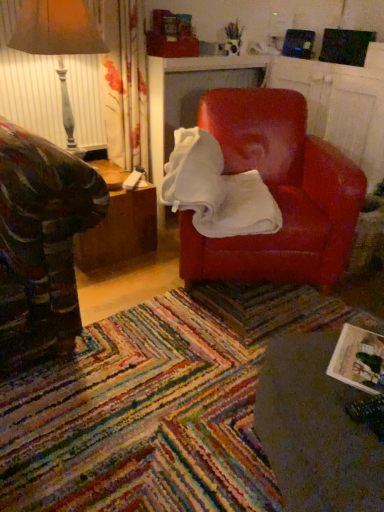
Question: Does matte leather chair at center appear on the right side of matte gray table lamp at left?

Choices:
 (A) yes
 (B) no

Answer: (A)

Question: Considering the relative sizes of matte leather chair at center and matte gray table lamp at left in the image provided, is matte leather chair at center shorter than matte gray table lamp at left?

Choices:
 (A) no
 (B) yes

Answer: (B)

Question: Is matte leather chair at center to the left of matte gray table lamp at left from the viewer's perspective?

Choices:
 (A) yes
 (B) no

Answer: (B)

Question: From a real-world perspective, is matte leather chair at center below matte gray table lamp at left?

Choices:
 (A) yes
 (B) no

Answer: (A)

Question: Is matte gray table lamp at left located within matte leather chair at center?

Choices:
 (A) no
 (B) yes

Answer: (A)

Question: Would you say matte gray table lamp at left is to the left or to the right of woodenmaterial/texturetable at left, placed as the 2th table when sorted from right to left, in the picture?

Choices:
 (A) right
 (B) left

Answer: (B)

Question: From the image's perspective, is matte gray table lamp at left above or below woodenmaterial/texturetable at left, arranged as the second table when viewed from the front?

Choices:
 (A) above
 (B) below

Answer: (A)

Question: Is matte gray table lamp at left situated inside woodenmaterial/texturetable at left, arranged as the second table when viewed from the front, or outside?

Choices:
 (A) outside
 (B) inside

Answer: (A)

Question: Considering their positions, is matte gray table lamp at left located in front of or behind woodenmaterial/texturetable at left, the second table positioned from the bottom?

Choices:
 (A) behind
 (B) front

Answer: (B)

Question: In the image, is woodenmaterial/texturetable at left, the first table viewed from the left, positioned in front of or behind matte gray table lamp at left?

Choices:
 (A) behind
 (B) front

Answer: (A)

Question: In terms of size, does woodenmaterial/texturetable at left, which is the 1th table from top to bottom, appear bigger or smaller than matte gray table lamp at left?

Choices:
 (A) big
 (B) small

Answer: (B)

Question: Would you say woodenmaterial/texturetable at left, the first table when ordered from back to front, is inside or outside matte gray table lamp at left?

Choices:
 (A) inside
 (B) outside

Answer: (B)

Question: From the image's perspective, is woodenmaterial/texturetable at left, arranged as the second table when viewed from the front, located above or below matte gray table lamp at left?

Choices:
 (A) above
 (B) below

Answer: (B)

Question: Considering their positions, is matte red armchair at center located in front of or behind matte white magazine at lower right?

Choices:
 (A) front
 (B) behind

Answer: (B)

Question: Based on their positions, is matte red armchair at center located to the left or right of matte white magazine at lower right?

Choices:
 (A) right
 (B) left

Answer: (B)